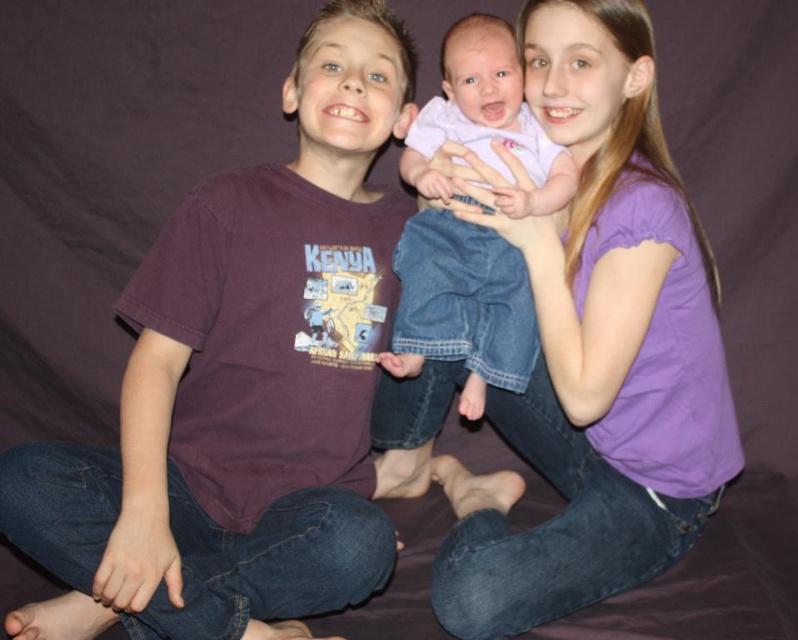
Question: Does purple cotton shirt at center appear on the left side of pink fabric baby at center?

Choices:
 (A) no
 (B) yes

Answer: (A)

Question: Which point is closer to the camera taking this photo?

Choices:
 (A) (455, 316)
 (B) (619, 24)

Answer: (B)

Question: Where is maroon t-shirt at left located in relation to purple cotton shirt at center in the image?

Choices:
 (A) right
 (B) left

Answer: (B)

Question: Does maroon t-shirt at left come in front of pink fabric baby at center?

Choices:
 (A) no
 (B) yes

Answer: (B)

Question: Based on their relative distances, which object is farther from the pink fabric baby at center?

Choices:
 (A) maroon t-shirt at left
 (B) purple cotton shirt at center

Answer: (A)

Question: Which of the following is the closest to the observer?

Choices:
 (A) (44, 547)
 (B) (688, 428)
 (C) (445, 72)

Answer: (A)